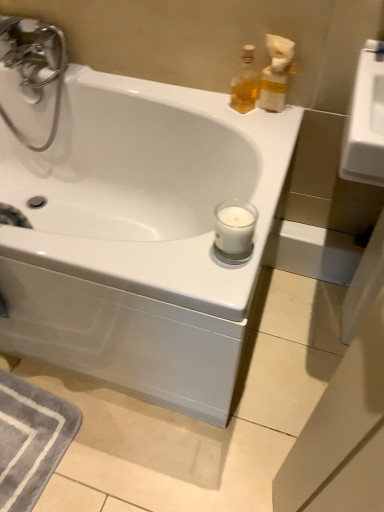
Identify the location of vacant space to the left of translucent glass bottle at upper right, placed as the 2th soap dispenser when sorted from right to left. The height and width of the screenshot is (512, 384). (201, 101).